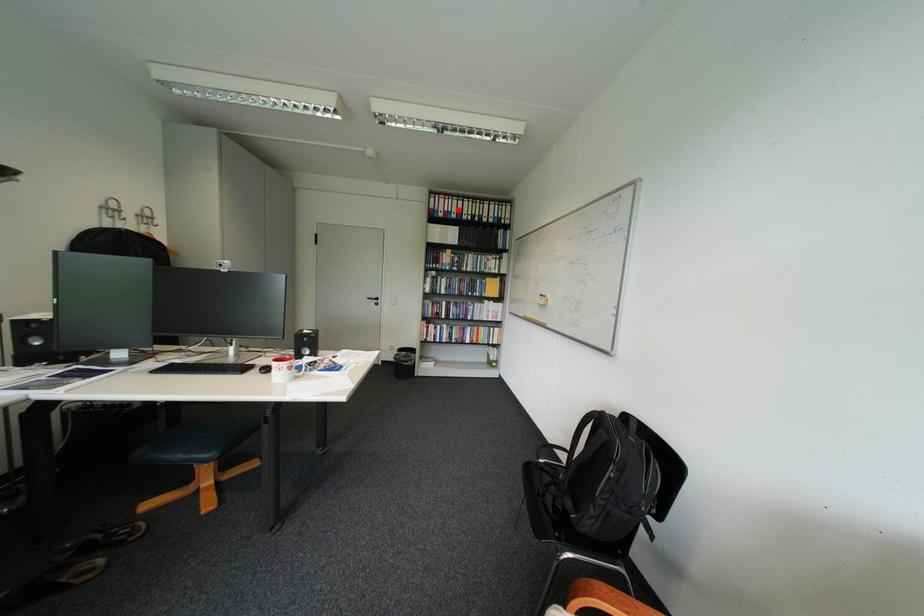
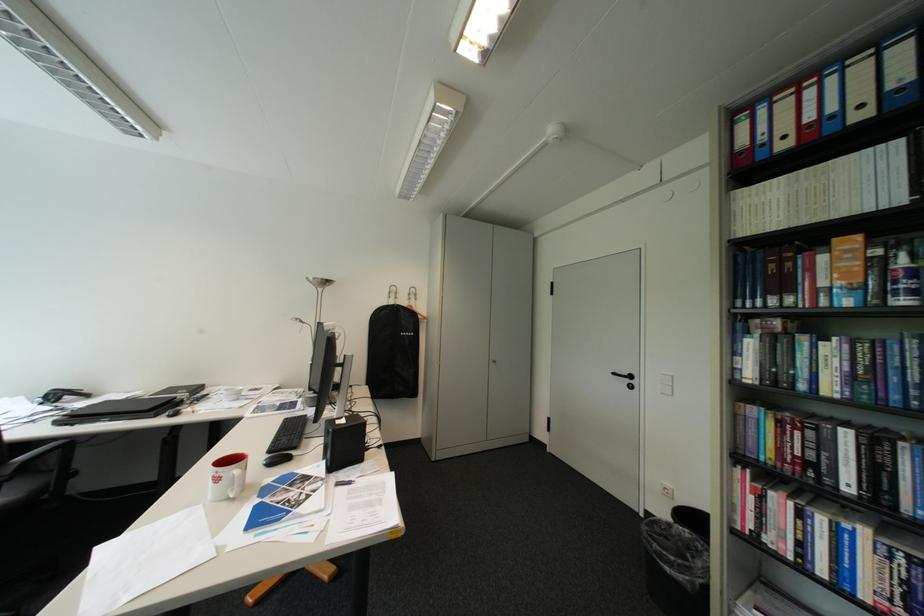
Find the pixel in the second image that matches the highlighted location in the first image.

(821, 119)